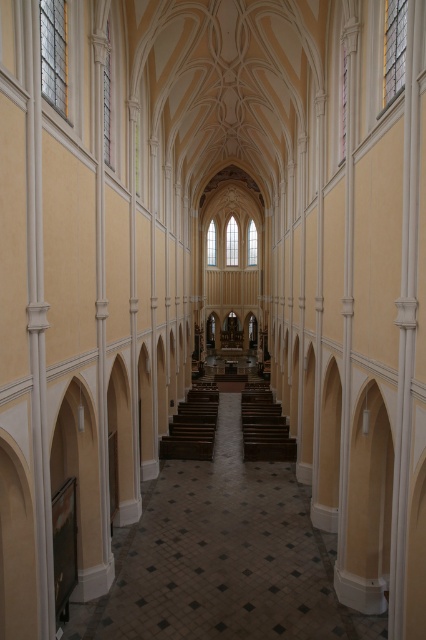
You are an architect evaluating the church layout. You need to determine which staircase, the brown polished wood stairs at center or the brown wooden stairs at center, requires more caution when ascending due to steeper steps. Which one is steeper?

The brown polished wood stairs at center has a greater height compared to the brown wooden stairs at center, so the brown polished wood stairs at center has steeper steps and requires more caution when ascending.

You are an architect designing a model of the church. You have two sets of stairs labeled as brown polished wood stairs at center and brown wooden stairs at center. According to the description, which one should you choose to ensure the model accurately represents the size difference mentioned?

The brown polished wood stairs at center should be chosen because it is bigger than the brown wooden stairs at center, ensuring the size difference is accurately represented in the model.

You are standing in the grand church and want to determine the relative positions of two points marked in the image. Which point is closer to you, point (187, 433) or point (259, 451)?

Point (187, 433) is closer to you because it is further to the viewer than point (259, 451).